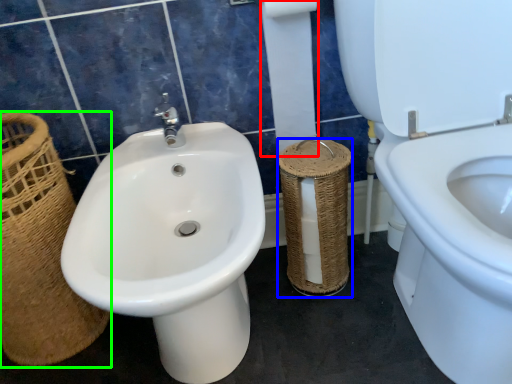
Question: Estimate the real-world distances between objects in this image. Which object is closer to toilet paper (highlighted by a red box), basket container (highlighted by a blue box) or basket (highlighted by a green box)?

Choices:
 (A) basket container
 (B) basket

Answer: (A)